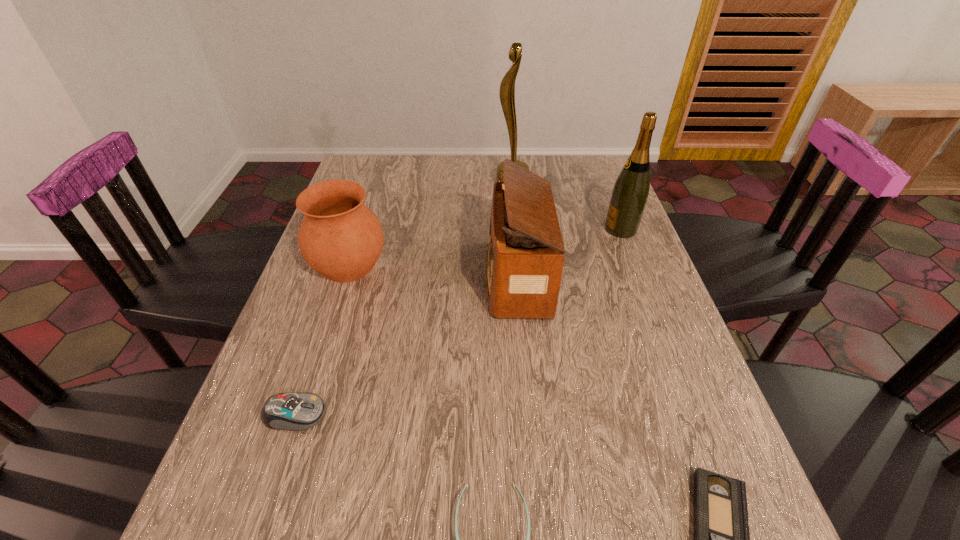
At what (x,y) coordinates should I click in order to perform the action: click on free space located on the front-facing side of the sixth shortest object. Please return your answer as a coordinate pair (x, y). This screenshot has width=960, height=540. Looking at the image, I should click on 493,229.

Identify the location of free point located on the front-facing side of the sixth shortest object. The height and width of the screenshot is (540, 960). (493, 229).

Identify the location of blank area located on the front-facing side of the sixth shortest object. The height and width of the screenshot is (540, 960). (565, 229).

The width and height of the screenshot is (960, 540). What are the coordinates of `vacant area situated on the front panel of the radio receiver` in the screenshot? It's located at (437, 278).

The image size is (960, 540). In order to click on vacant space located on the front panel of the radio receiver in this screenshot , I will do `click(424, 278)`.

The width and height of the screenshot is (960, 540). In order to click on free space located 0.100m on the front panel of the radio receiver in this screenshot , I will do `click(444, 278)`.

This screenshot has height=540, width=960. In order to click on vacant area situated 0.340m on the front of the fourth tallest object in this screenshot , I will do `click(297, 424)`.

Where is `free space located on the wheel side of the fifth farthest object`? free space located on the wheel side of the fifth farthest object is located at coordinates (493, 415).

Locate an element on the screen. Image resolution: width=960 pixels, height=540 pixels. object present at the far edge is located at coordinates (507, 87).

Image resolution: width=960 pixels, height=540 pixels. Identify the location of pottery positioned at the left edge. (341, 238).